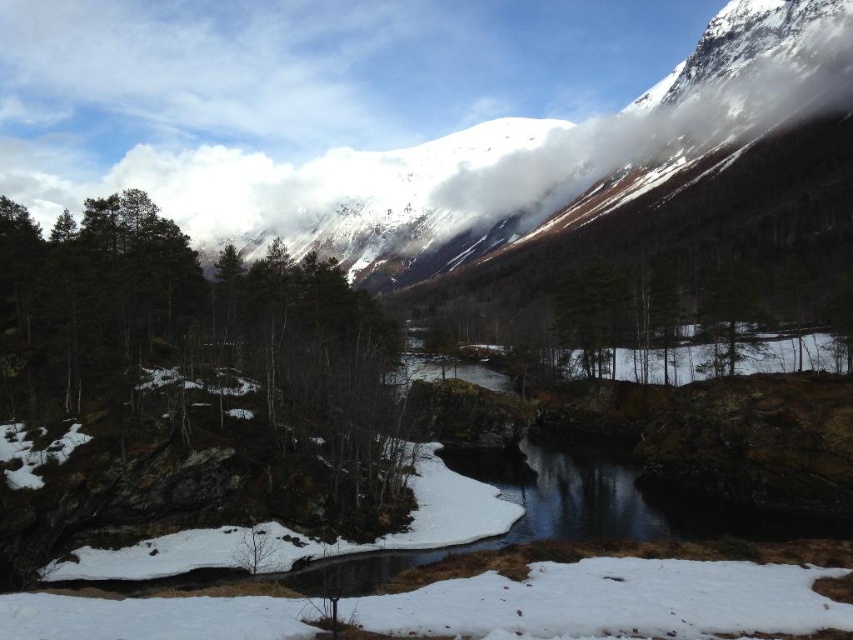
Can you confirm if green matte tree at center is positioned below white fluffy cloud at upper center?

A: Indeed, green matte tree at center is positioned under white fluffy cloud at upper center.

Does green matte tree at center come behind white fluffy cloud at upper center?

No, it is not.

Locate an element on the screen. This screenshot has height=640, width=853. green matte tree at center is located at coordinates (204, 353).

Find the location of `green matte tree at center`. green matte tree at center is located at coordinates coord(204,353).